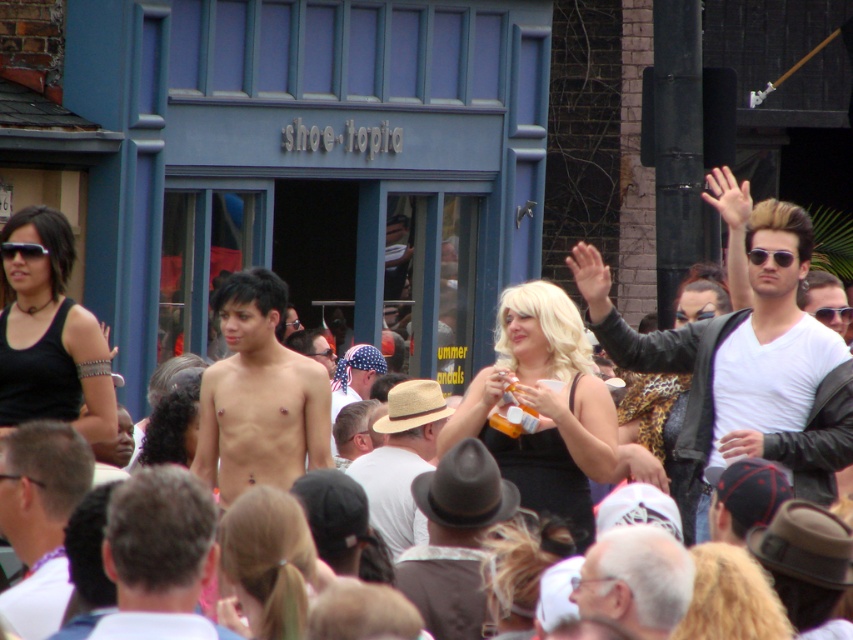
You are a photographer at the event and want to focus on capturing the black matte dress at center and the blonde hair at center. Which object is closer to your camera lens?

The black matte dress at center is closer to the camera lens because it is further to the viewer than the blonde hair at center.

You are a photographer at the event and want to capture both the blonde hair at center and the dark brown hair at center in a single frame. Which hairstyle would require you to adjust your camera angle to ensure both are fully visible?

The blonde hair at center is shorter than the dark brown hair at center, so you would need to adjust your camera angle to accommodate the height difference between the two hairstyles to ensure both are fully visible.